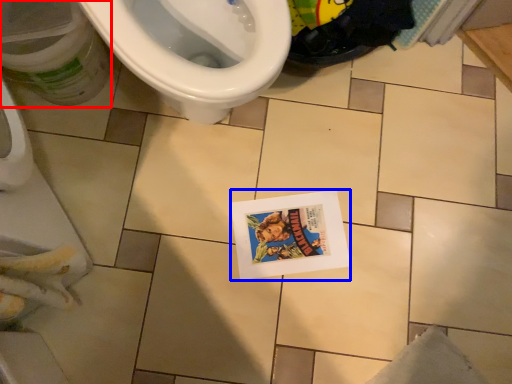
Question: Which of the following is the farthest to the observer, potty (highlighted by a red box) or comic book (highlighted by a blue box)?

Choices:
 (A) potty
 (B) comic book

Answer: (B)